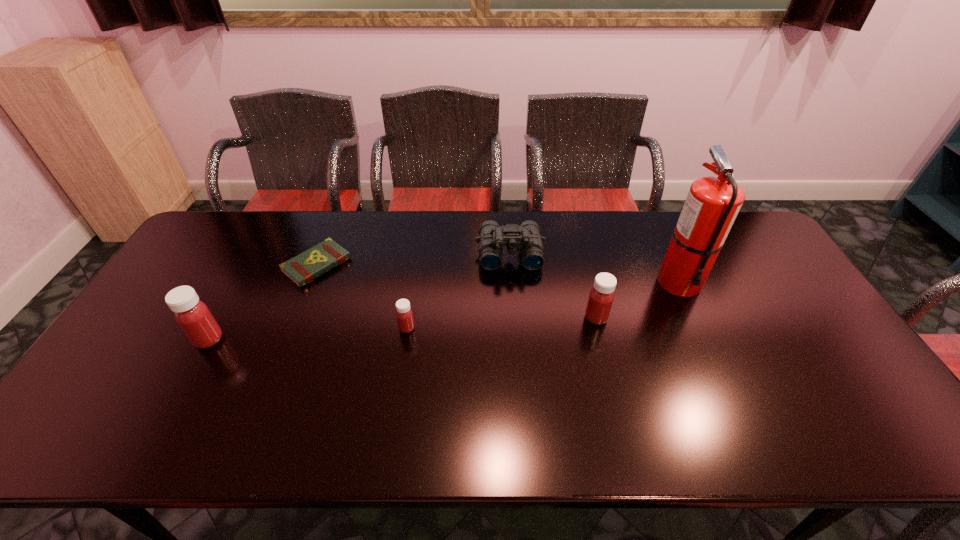
Find the location of a particular element. The image size is (960, 540). fire extinguisher is located at coordinates (713, 203).

Where is `vacant space positioned on the right of the leftmost medicine`? The height and width of the screenshot is (540, 960). vacant space positioned on the right of the leftmost medicine is located at coordinates (371, 340).

You are a GUI agent. You are given a task and a screenshot of the screen. Output one action in this format:
    pyautogui.click(x=<x>, y=<y>)
    Task: Click on the vacant area located on the right of the second shortest object
    
    Given the screenshot: What is the action you would take?
    pyautogui.click(x=513, y=328)

The height and width of the screenshot is (540, 960). I want to click on vacant space located on the left of the second shortest medicine, so click(511, 318).

Where is `free space located 0.070m on the left of the shortest object`? free space located 0.070m on the left of the shortest object is located at coordinates (263, 265).

Identify the location of vacant space situated through the lenses of the fourth object from left to right. (516, 329).

Locate an element on the screen. The height and width of the screenshot is (540, 960). vacant position located 0.290m at the nozzle of the rightmost object is located at coordinates (730, 392).

The height and width of the screenshot is (540, 960). Find the location of `book situated at the far edge`. book situated at the far edge is located at coordinates (302, 269).

Identify the location of binoculars that is at the far edge. (527, 236).

Identify the location of vacant space at the far edge. This screenshot has height=540, width=960. 590,211.